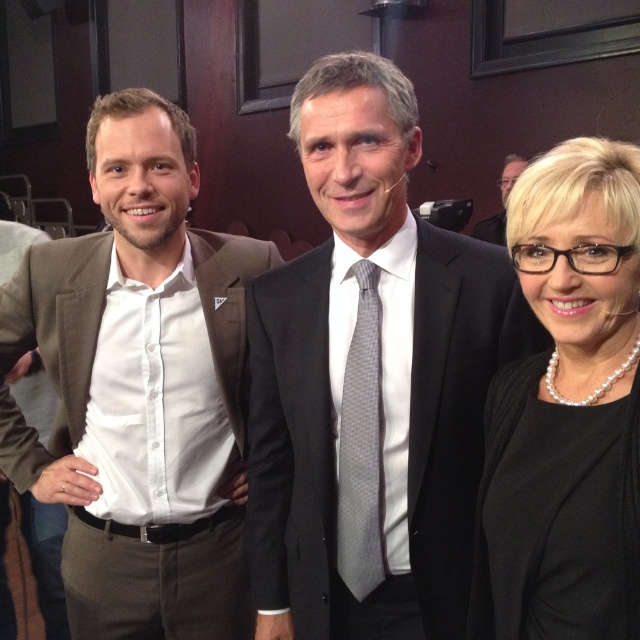
Question: Which object appears farthest from the camera in this image?

Choices:
 (A) dark gray suit at center
 (B) matte brown suit at left
 (C) pearl necklace at center
 (D) black silk suit at center

Answer: (A)

Question: Is matte brown suit at left to the left of pearl necklace at center from the viewer's perspective?

Choices:
 (A) yes
 (B) no

Answer: (A)

Question: Is matte brown suit at left closer to the viewer compared to gray dotted tie at center?

Choices:
 (A) yes
 (B) no

Answer: (B)

Question: Which point appears closest to the camera in this image?

Choices:
 (A) (515, 164)
 (B) (291, 314)
 (C) (134, 497)
 (D) (556, 483)

Answer: (D)

Question: Which point is closer to the camera taking this photo?

Choices:
 (A) 477,401
 (B) 512,163

Answer: (A)

Question: Does matte brown suit at left appear over pearl necklace at center?

Choices:
 (A) no
 (B) yes

Answer: (B)